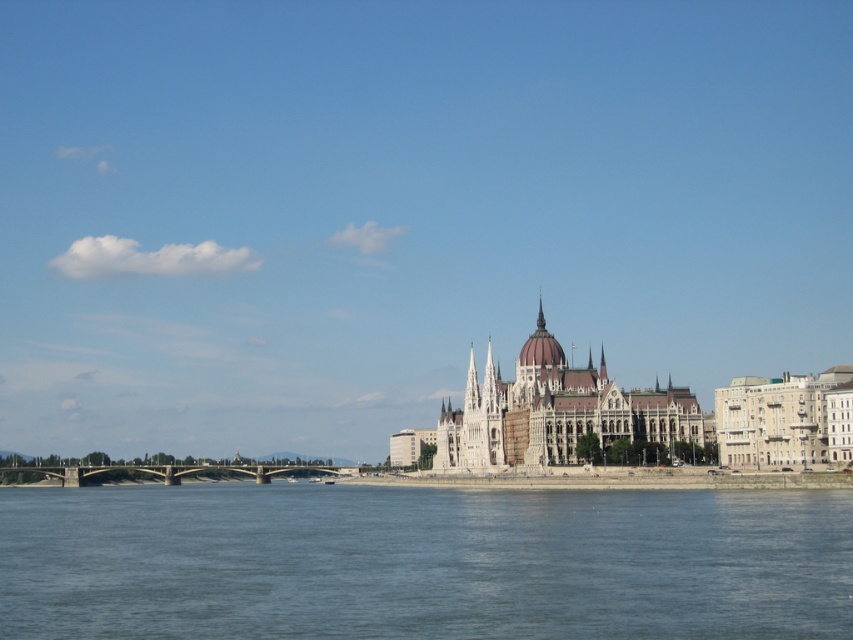
Based on the photo, which is above, blue water at lower center or concrete bridge at lower left?

Positioned higher is blue water at lower center.

The height and width of the screenshot is (640, 853). Describe the element at coordinates (422, 563) in the screenshot. I see `blue water at lower center` at that location.

Is point (814, 529) in front of point (177, 470)?

Yes, it is in front of point (177, 470).

At what (x,y) coordinates should I click in order to perform the action: click on blue water at lower center. Please return your answer as a coordinate pair (x, y). The width and height of the screenshot is (853, 640). Looking at the image, I should click on (422, 563).